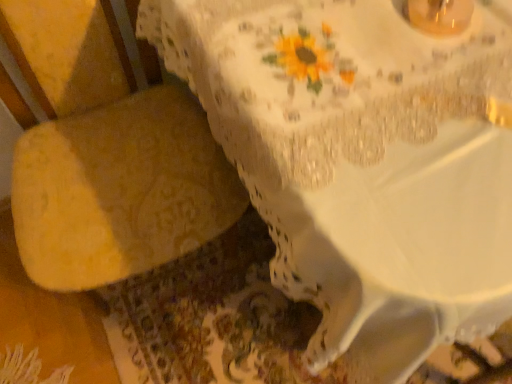
Question: From the image's perspective, does yellow fabric armchair at left appear lower than white lace tablecloth at upper center?

Choices:
 (A) no
 (B) yes

Answer: (B)

Question: Is yellow fabric armchair at left oriented towards white lace tablecloth at upper center?

Choices:
 (A) no
 (B) yes

Answer: (A)

Question: Is yellow fabric armchair at left wider than white lace tablecloth at upper center?

Choices:
 (A) yes
 (B) no

Answer: (B)

Question: Considering the relative sizes of yellow fabric armchair at left and white lace tablecloth at upper center in the image provided, is yellow fabric armchair at left taller than white lace tablecloth at upper center?

Choices:
 (A) yes
 (B) no

Answer: (A)

Question: Is the position of yellow fabric armchair at left more distant than that of white lace tablecloth at upper center?

Choices:
 (A) no
 (B) yes

Answer: (A)

Question: Is yellow fabric armchair at left oriented away from white lace tablecloth at upper center?

Choices:
 (A) yes
 (B) no

Answer: (B)

Question: From the image's perspective, is white lace tablecloth at upper center located above yellow fabric armchair at left?

Choices:
 (A) no
 (B) yes

Answer: (B)

Question: Can you confirm if white lace tablecloth at upper center is wider than yellow fabric armchair at left?

Choices:
 (A) yes
 (B) no

Answer: (A)

Question: From a real-world perspective, does white lace tablecloth at upper center stand above yellow fabric armchair at left?

Choices:
 (A) no
 (B) yes

Answer: (A)

Question: Is white lace tablecloth at upper center located outside yellow fabric armchair at left?

Choices:
 (A) yes
 (B) no

Answer: (A)

Question: Is white lace tablecloth at upper center further to camera compared to yellow fabric armchair at left?

Choices:
 (A) yes
 (B) no

Answer: (A)

Question: Is white lace tablecloth at upper center to the right of yellow fabric armchair at left from the viewer's perspective?

Choices:
 (A) no
 (B) yes

Answer: (B)

Question: Relative to white lace tablecloth at upper center, is yellow fabric armchair at left in front or behind?

Choices:
 (A) behind
 (B) front

Answer: (B)